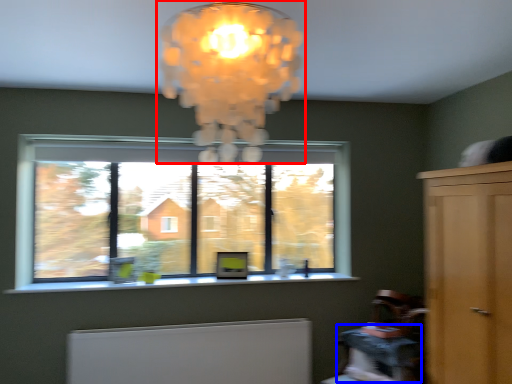
Question: Which object appears closest to the camera in this image, lamp (highlighted by a red box) or table (highlighted by a blue box)?

Choices:
 (A) lamp
 (B) table

Answer: (A)